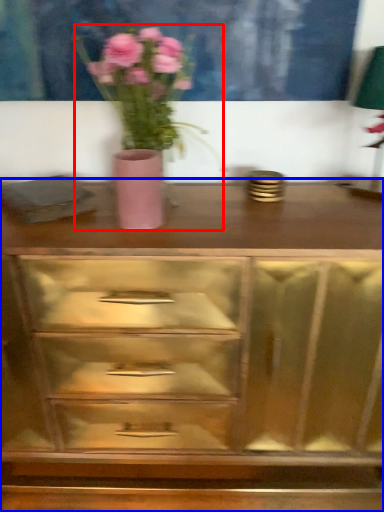
Question: Among these objects, which one is nearest to the camera, floral arrangement (highlighted by a red box) or chest of drawers (highlighted by a blue box)?

Choices:
 (A) floral arrangement
 (B) chest of drawers

Answer: (A)